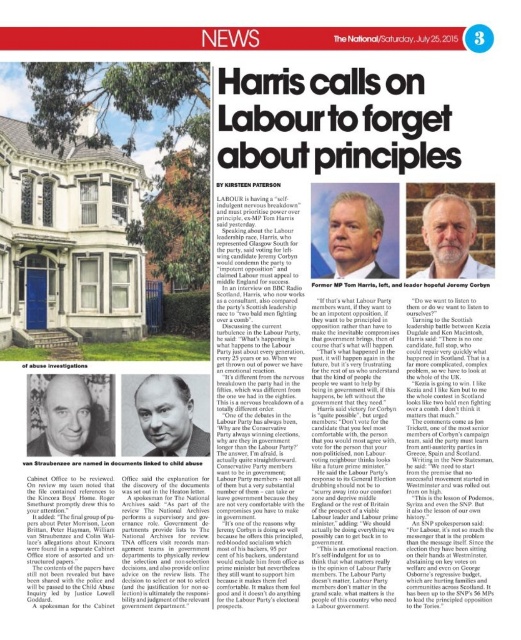
Is matte black portrait at center taller than gray beard at upper center?

No, matte black portrait at center is not taller than gray beard at upper center.

Is matte black portrait at center above gray beard at upper center?

Actually, matte black portrait at center is below gray beard at upper center.

At what (x,y) coordinates should I click in order to perform the action: click on matte black portrait at center. Please return your answer as a coordinate pair (x, y). Looking at the image, I should click on (168, 417).

Find the location of `matte black portrait at center`. matte black portrait at center is located at coordinates (168, 417).

Between matte black portrait at center and gray hair man at center, which one appears on the right side from the viewer's perspective?

gray hair man at center

Is matte black portrait at center taller than gray hair man at center?

No.

Is point (157, 435) positioned before point (370, 268)?

Yes, point (157, 435) is in front of point (370, 268).

The width and height of the screenshot is (521, 640). I want to click on matte black portrait at center, so click(168, 417).

Can you confirm if gray beard at upper center is shorter than gray hair man at center?

Yes.

The height and width of the screenshot is (640, 521). I want to click on gray beard at upper center, so click(x=451, y=240).

The image size is (521, 640). In order to click on gray beard at upper center in this screenshot , I will do [x=451, y=240].